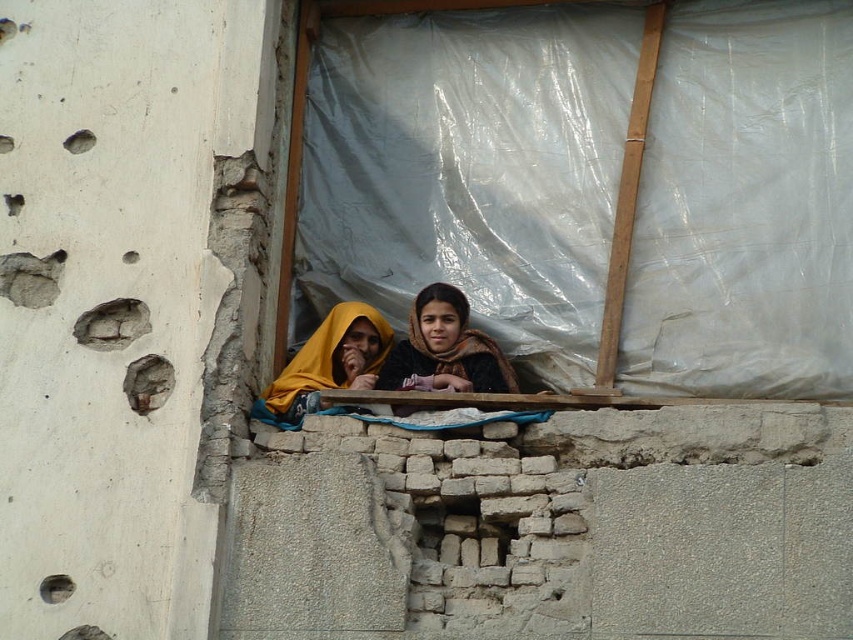
Question: Which point appears farthest from the camera in this image?

Choices:
 (A) (454, 300)
 (B) (260, 397)

Answer: (A)

Question: Which object appears closest to the camera in this image?

Choices:
 (A) yellow fabric at center
 (B) dark brown scarf at center

Answer: (B)

Question: Does dark brown scarf at center appear on the left side of yellow fabric at center?

Choices:
 (A) yes
 (B) no

Answer: (B)

Question: Which object is closer to the camera taking this photo?

Choices:
 (A) dark brown scarf at center
 (B) yellow fabric at center

Answer: (A)

Question: Is dark brown scarf at center thinner than yellow fabric at center?

Choices:
 (A) yes
 (B) no

Answer: (B)

Question: Is dark brown scarf at center in front of yellow fabric at center?

Choices:
 (A) yes
 (B) no

Answer: (A)